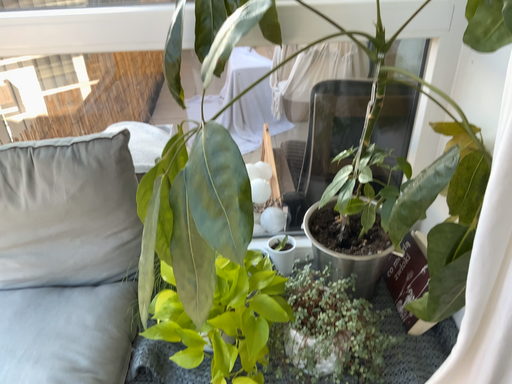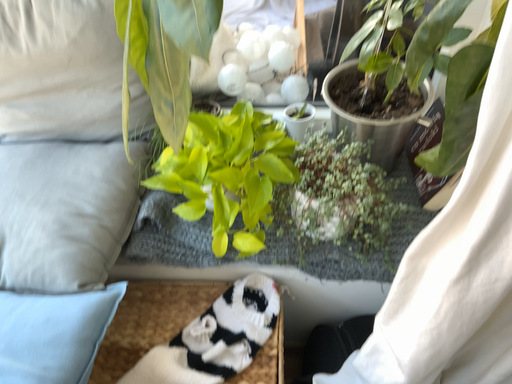
Question: Which way did the camera rotate in the video?

Choices:
 (A) rotated downward
 (B) rotated upward

Answer: (A)